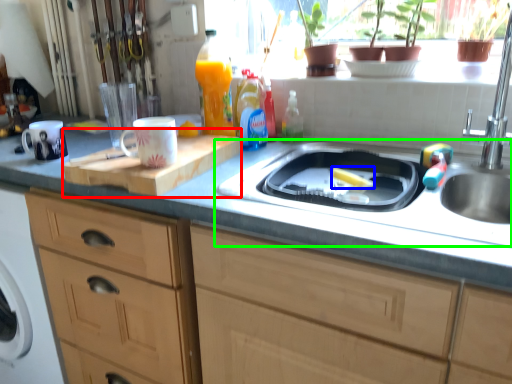
Question: Which is farther away from cutting board (highlighted by a red box)? food (highlighted by a blue box) or sink (highlighted by a green box)?

Choices:
 (A) food
 (B) sink

Answer: (A)